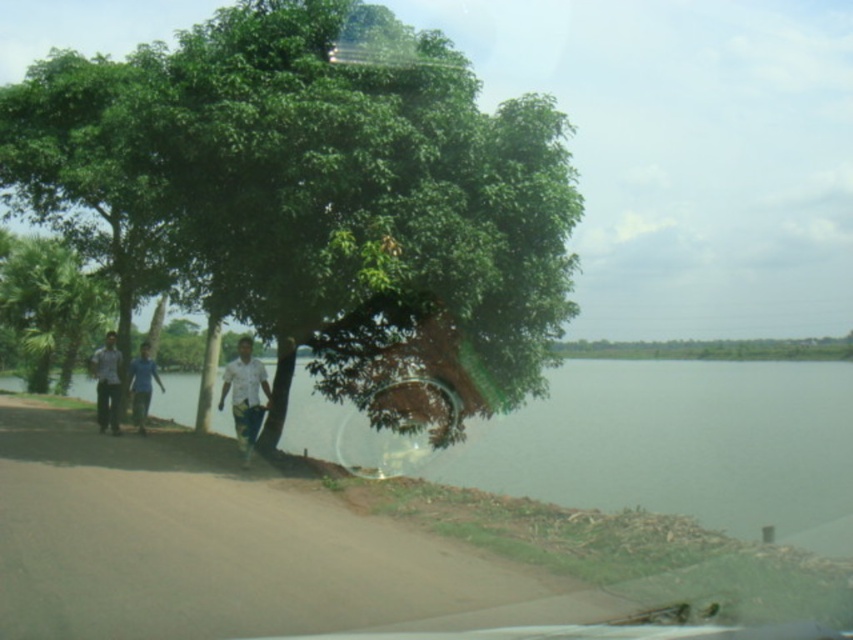
Question: Among these objects, which one is nearest to the camera?

Choices:
 (A) white shirt at center
 (B) light blue shirt at left

Answer: (A)

Question: Which point is farther from the camera taking this photo?

Choices:
 (A) (80, 163)
 (B) (784, 410)
 (C) (155, 369)

Answer: (B)

Question: Does green leafy tree at center lie in front of light blue shirt at left?

Choices:
 (A) no
 (B) yes

Answer: (B)

Question: Is white shirt at center thinner than blue cotton shirt at center?

Choices:
 (A) no
 (B) yes

Answer: (B)

Question: Based on their relative distances, which object is farther from the green leafy tree at center?

Choices:
 (A) green water at lower left
 (B) blue cotton shirt at center
 (C) white shirt at center
 (D) light blue shirt at left

Answer: (A)

Question: Is the position of green leafy tree at center less distant than that of blue cotton shirt at center?

Choices:
 (A) yes
 (B) no

Answer: (A)